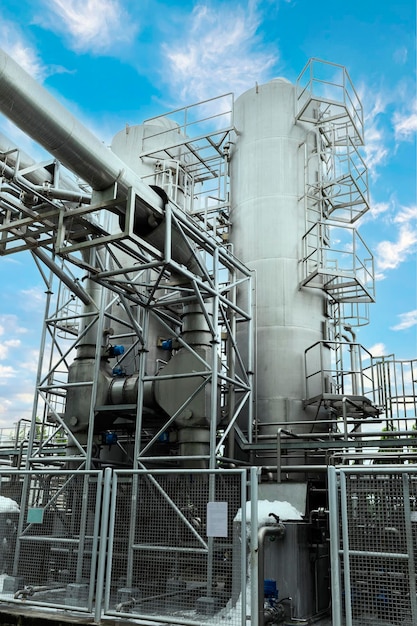
Locate an element on the screen. This screenshot has width=417, height=626. entry is located at coordinates (300, 572).